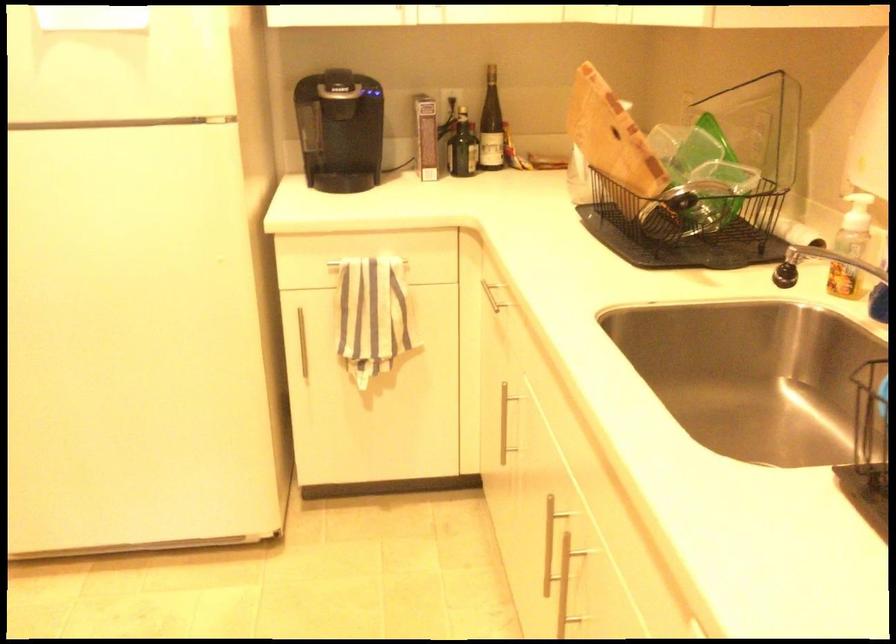
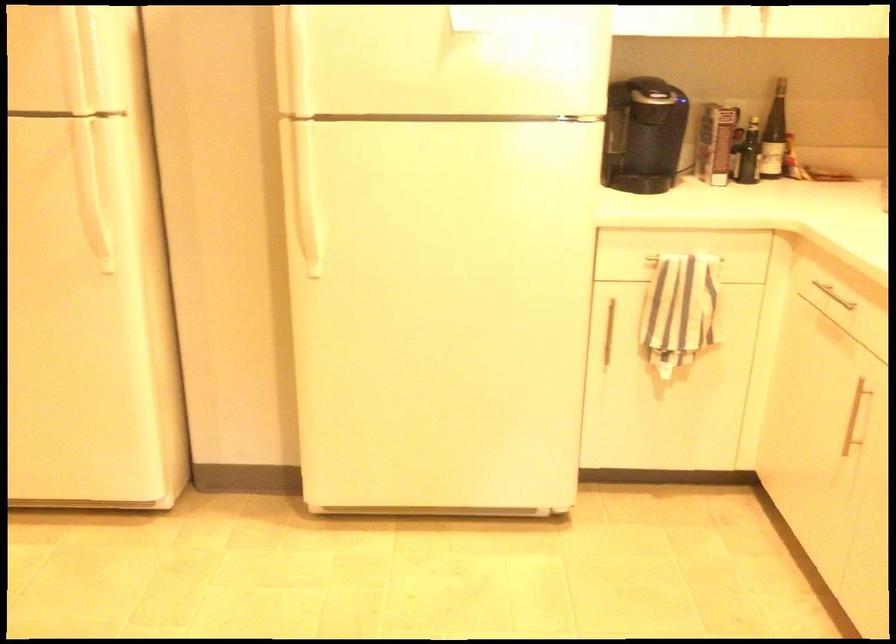
Question: The camera is either moving clockwise (left) or counter-clockwise (right) around the object. The first image is from the beginning of the video and the second image is from the end. Is the camera moving left or right when shooting the video?

Choices:
 (A) Left
 (B) Right

Answer: (B)